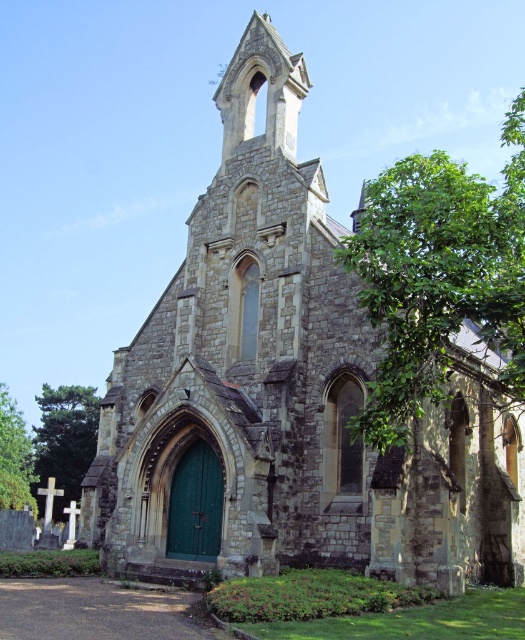
You are standing in front of the stone chapel and want to take a photo of the main entrance. There are two green leafy trees in the scene. Which tree, the green leafy tree at right or the green leafy tree at lower left, is closer to you and might block your view of the chapel entrance?

The green leafy tree at right is in front of the green leafy tree at lower left, so it is closer to you and might block your view of the chapel entrance.

You are standing in front of the stone chapel and want to take a photo of the green leafy tree at right. Which direction should you turn your camera to capture it in the frame?

The green leafy tree at right is located to the right side of the chapel, so you should turn your camera to the right to capture it in the frame.

You are standing in front of the stone chapel and want to determine the relative positions of two points marked on the facade. Which point is closer to you, point [499,339] or point [71,472]?

Point [499,339] is closer to the viewer than point [71,472].